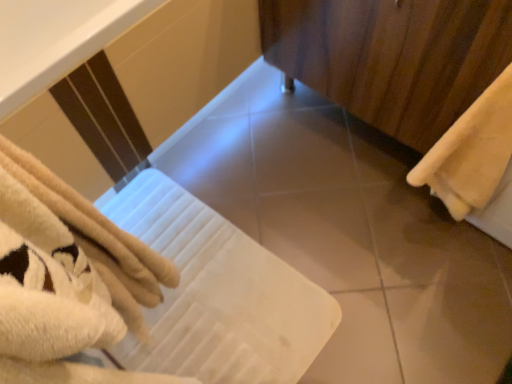
The width and height of the screenshot is (512, 384). What do you see at coordinates (321, 236) in the screenshot?
I see `smooth beige tile at center` at bounding box center [321, 236].

Locate an element on the screen. The width and height of the screenshot is (512, 384). white soft towel at center is located at coordinates (218, 294).

Is wooden curtain at right in front of or behind white soft towel at center in the image?

Visually, wooden curtain at right is located in front of white soft towel at center.

Who is taller, wooden curtain at right or white soft towel at center?

Standing taller between the two is wooden curtain at right.

In the image, is wooden curtain at right on the left side or the right side of white soft towel at center?

From the image, it's evident that wooden curtain at right is to the right of white soft towel at center.

Based on their sizes in the image, would you say beige soft towel at right is bigger or smaller than smooth beige tile at center?

beige soft towel at right is bigger than smooth beige tile at center.

Is point (429, 171) more distant than point (314, 246)?

No, it is not.

From a real-world perspective, is beige soft towel at right below smooth beige tile at center?

No.

Find the location of a particular element. The width and height of the screenshot is (512, 384). curtain located above the white soft towel at center (from a real-world perspective) is located at coordinates (392, 57).

From the image's perspective, is white soft towel at center below wooden curtain at right?

Indeed, from the image's perspective, white soft towel at center is shown beneath wooden curtain at right.

Considering the relative positions of white soft towel at center and wooden curtain at right in the image provided, is white soft towel at center to the right of wooden curtain at right from the viewer's perspective?

No.

From a real-world perspective, who is located higher, white soft towel at center or wooden curtain at right?

wooden curtain at right is physically above.

This screenshot has width=512, height=384. I want to click on bath towel below the beige soft towel at right (from a real-world perspective), so click(x=218, y=294).

Is white soft towel at center at the right side of beige soft towel at right?

In fact, white soft towel at center is to the left of beige soft towel at right.

Is white soft towel at center looking in the opposite direction of beige soft towel at right?

No, white soft towel at center's orientation is not away from beige soft towel at right.

Which of these two, white soft towel at center or smooth beige tile at center, is thinner?

With smaller width is smooth beige tile at center.

Looking at this image, is white soft towel at center next to smooth beige tile at center and touching it?

There is a gap between white soft towel at center and smooth beige tile at center.

Can you confirm if white soft towel at center is taller than smooth beige tile at center?

In fact, white soft towel at center may be shorter than smooth beige tile at center.

Is smooth beige tile at center at the back of white soft towel at center?

No, white soft towel at center's orientation is not away from smooth beige tile at center.

Does point (360, 80) lie behind point (482, 104)?

That is True.

Consider the image. Who is smaller, wooden curtain at right or beige soft towel at right?

With smaller size is beige soft towel at right.

From the image's perspective, between wooden curtain at right and beige soft towel at right, which one is located above?

From the image's view, wooden curtain at right is above.

From their relative heights in the image, would you say wooden curtain at right is taller or shorter than beige soft towel at right?

wooden curtain at right is taller than beige soft towel at right.

Is wooden curtain at right at the back of smooth beige tile at center?

No, smooth beige tile at center is not facing away from wooden curtain at right.

From the picture: From a real-world perspective, is smooth beige tile at center located beneath wooden curtain at right?

Indeed, from a real-world perspective, smooth beige tile at center is positioned beneath wooden curtain at right.

How distant is smooth beige tile at center from wooden curtain at right?

They are 16.42 inches apart.

The height and width of the screenshot is (384, 512). Identify the location of curtain above the white soft towel at center (from the image's perspective). (392, 57).

This screenshot has height=384, width=512. I want to click on tile below the beige soft towel at right (from a real-world perspective), so click(321, 236).

Based on their spatial positions, is wooden curtain at right or smooth beige tile at center further from white soft towel at center?

Among the two, wooden curtain at right is located further to white soft towel at center.

Which object lies nearer to the anchor point smooth beige tile at center, wooden curtain at right or beige soft towel at right?

Among the two, beige soft towel at right is located nearer to smooth beige tile at center.

Which object lies nearer to the anchor point wooden curtain at right, white soft towel at center or smooth beige tile at center?

smooth beige tile at center.

Considering their positions, is smooth beige tile at center positioned further to wooden curtain at right than white soft towel at center?

Based on the image, white soft towel at center appears to be further to wooden curtain at right.

From the image, which object appears to be farther from beige soft towel at right, smooth beige tile at center or white soft towel at center?

white soft towel at center.

From the picture: From the image, which object appears to be nearer to beige soft towel at right, white soft towel at center or smooth beige tile at center?

smooth beige tile at center is closer to beige soft towel at right.

Estimate the real-world distances between objects in this image. Which object is closer to smooth beige tile at center, white soft towel at center or beige soft towel at right?

white soft towel at center is closer to smooth beige tile at center.

Considering their positions, is smooth beige tile at center positioned further to white soft towel at center than wooden curtain at right?

The object further to white soft towel at center is wooden curtain at right.

I want to click on tile situated between white soft towel at center and beige soft towel at right from left to right, so click(321, 236).

At what (x,y) coordinates should I click in order to perform the action: click on tile between wooden curtain at right and white soft towel at center from top to bottom. Please return your answer as a coordinate pair (x, y). This screenshot has width=512, height=384. Looking at the image, I should click on (321, 236).

Where is `curtain positioned between beige soft towel at right and smooth beige tile at center from near to far`? The height and width of the screenshot is (384, 512). curtain positioned between beige soft towel at right and smooth beige tile at center from near to far is located at coordinates (392, 57).

Identify the location of towel between wooden curtain at right and white soft towel at center from top to bottom. (471, 152).